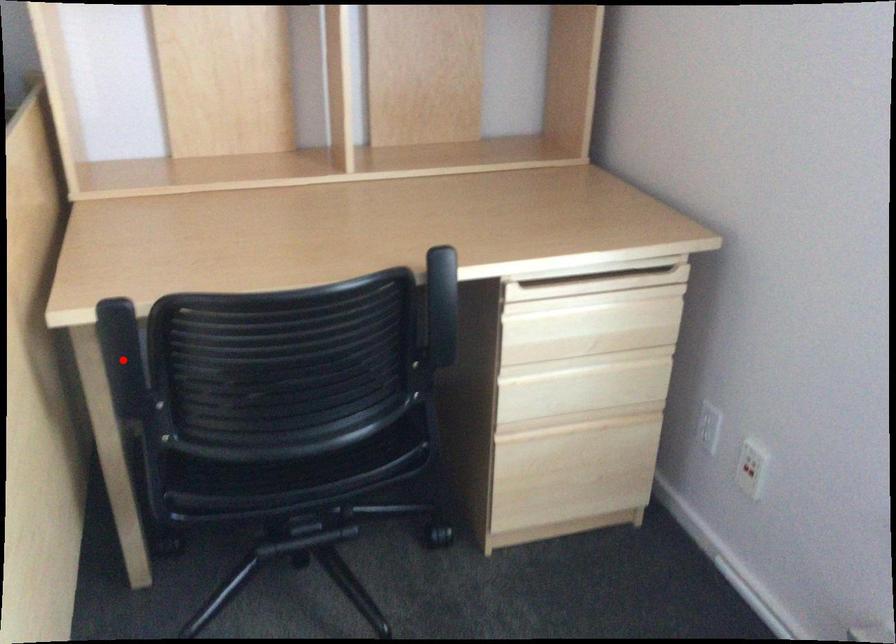
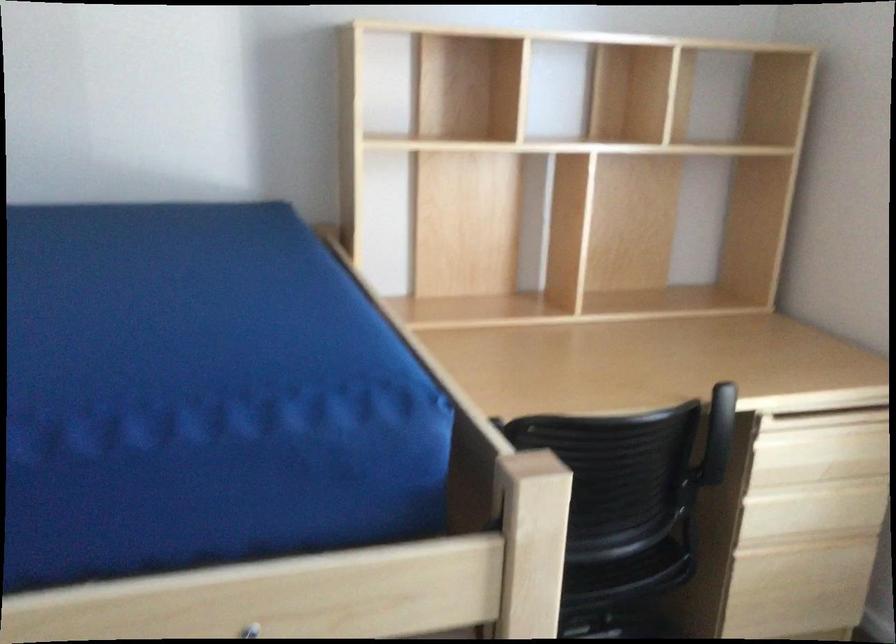
Question: I am providing you with two images of the same scene from different viewpoints. A red point is marked on the first image. Can you still see the location of the red point in image 2?

Choices:
 (A) Yes
 (B) No

Answer: (B)